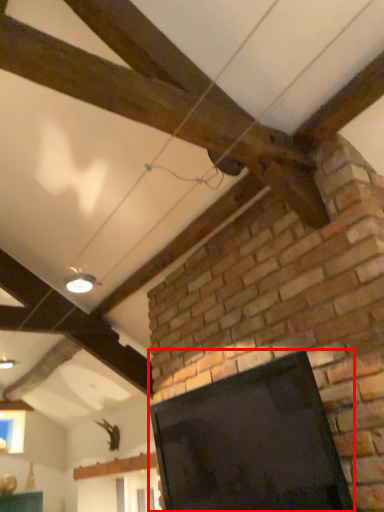
Question: From the image's perspective, considering the relative positions of screen (annotated by the red box) and light fixture in the image provided, where is screen (annotated by the red box) located with respect to the staircase?

Choices:
 (A) below
 (B) above

Answer: (A)